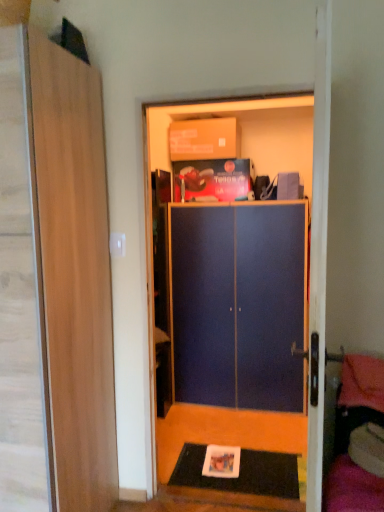
Locate an element on the screen. free location above black rubber doormat at lower center (from a real-world perspective) is located at coordinates (242, 461).